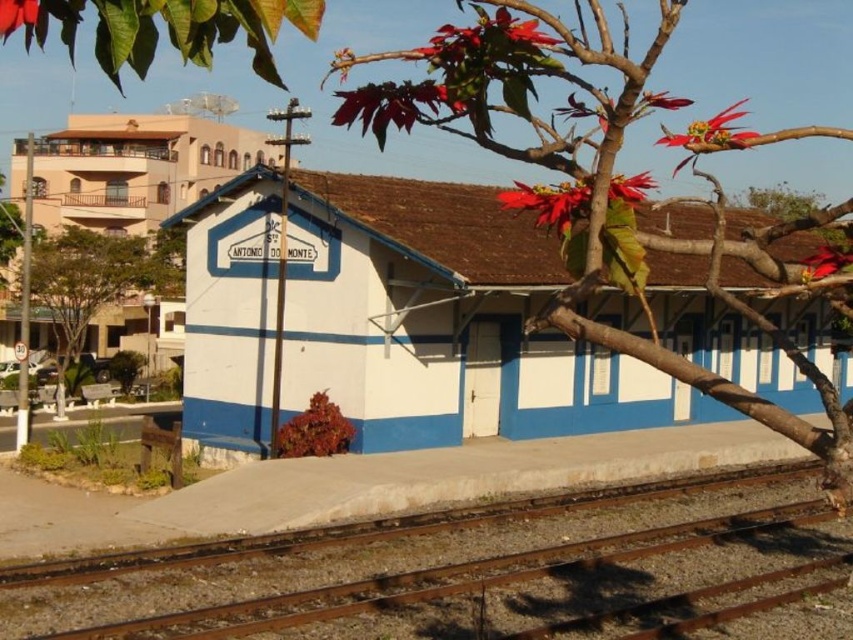
You are a passenger standing on the railway platform next to the white painted wood railway station at center. You want to take a photo of the red matte flower at upper right. Can you see the flower in the photo without any obstruction?

The white painted wood railway station at center is in front of the red matte flower at upper right, so the station will block your view of the flower in the photo.